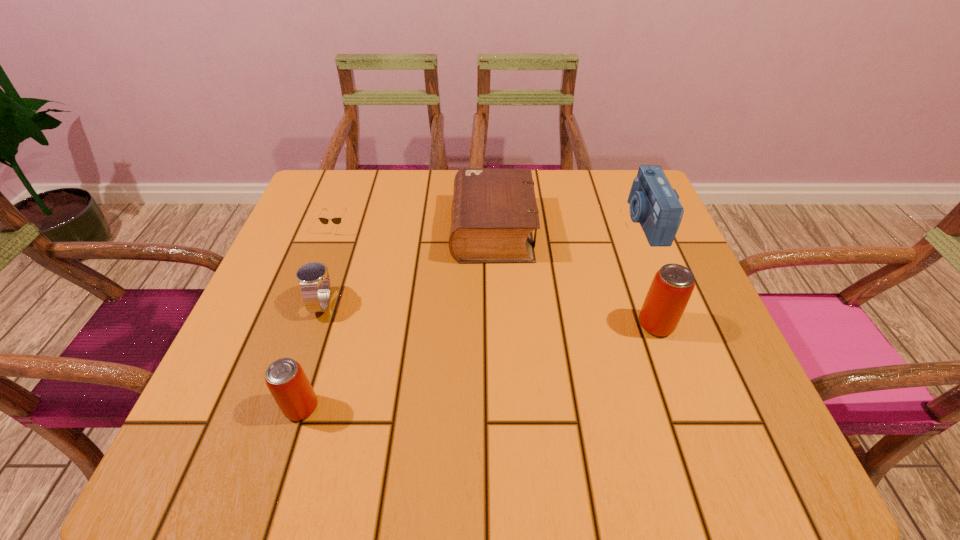
To achieve uniform spacing by inserting another beer_can among them, please point to a free space for this new beer_can. Please provide its 2D coordinates. Your answer should be formatted as a tuple, i.e. [(x, y)], where the tuple contains the x and y coordinates of a point satisfying the conditions above.

[(492, 363)]